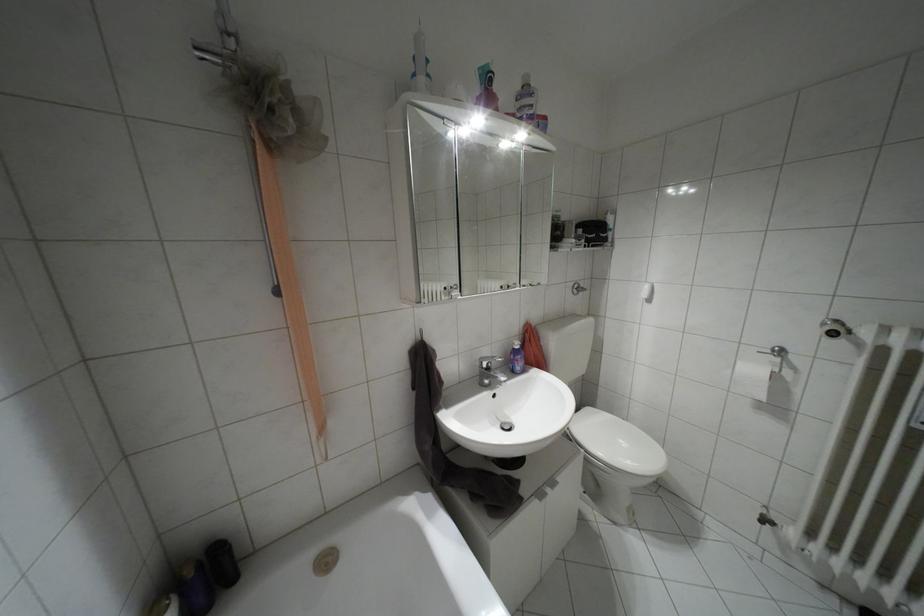
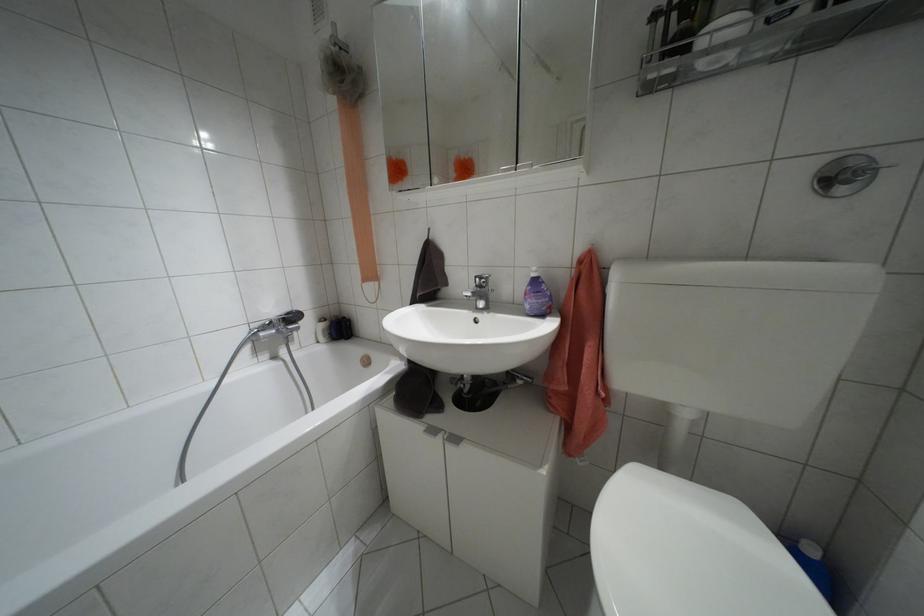
Locate, in the second image, the point that corresponds to pixel 517 346 in the first image.

(532, 274)